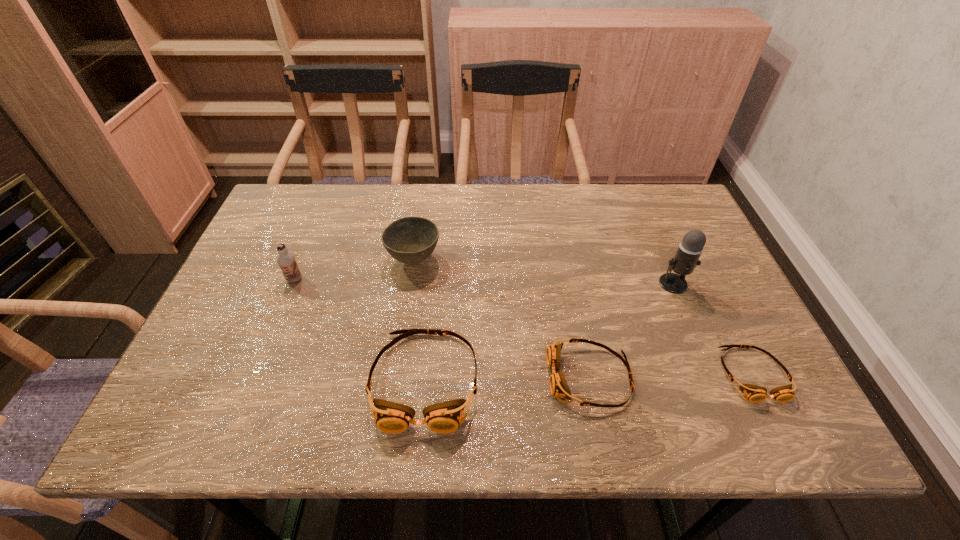
I want to click on vacant space at the far edge of the desktop, so click(x=583, y=230).

This screenshot has width=960, height=540. In order to click on free region at the near edge of the desktop in this screenshot , I will do `click(287, 386)`.

Image resolution: width=960 pixels, height=540 pixels. In the image, there is a desktop. In order to click on vacant space at the right edge in this screenshot , I will do `click(731, 329)`.

In the image, there is a desktop. Where is `vacant space at the far left corner`? vacant space at the far left corner is located at coordinates (279, 219).

Identify the location of vacant point at the near right corner. Image resolution: width=960 pixels, height=540 pixels. (704, 370).

Find the location of a particular element. Image resolution: width=960 pixels, height=540 pixels. free space between the leftmost goggles and the third tallest object is located at coordinates (420, 320).

The width and height of the screenshot is (960, 540). In order to click on vacant space that is in between the leftmost object and the tallest goggles in this screenshot , I will do `click(360, 330)`.

Locate an element on the screen. This screenshot has width=960, height=540. free space between the chocolate milk and the bowl is located at coordinates (354, 270).

Where is `free space between the bowl and the second shortest object`? free space between the bowl and the second shortest object is located at coordinates (502, 319).

Find the location of a particular element. vacant space that's between the leftmost object and the fourth shortest object is located at coordinates (354, 270).